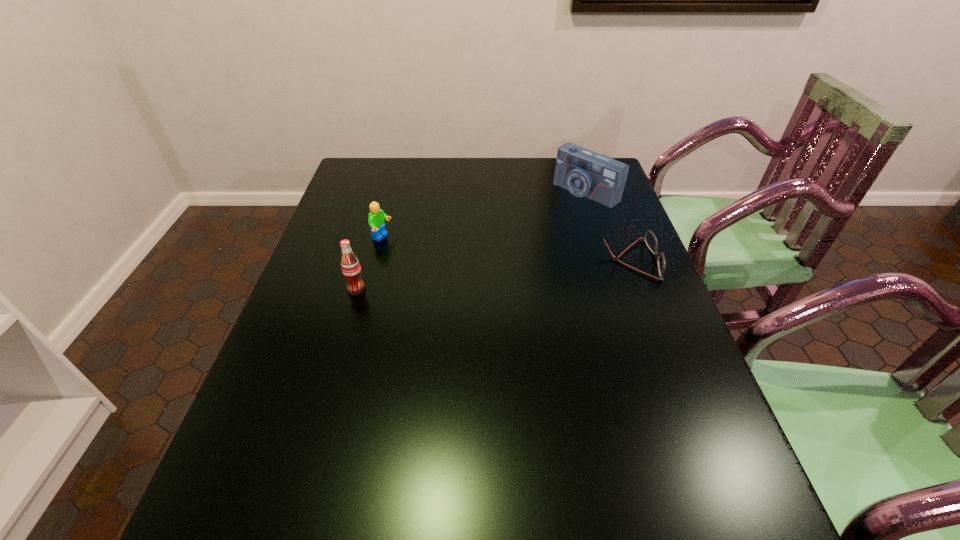
This screenshot has width=960, height=540. Find the location of `vacant space on the desktop that is between the nearest object and the shortest object and is positioned on the lens of the farthest object`. vacant space on the desktop that is between the nearest object and the shortest object and is positioned on the lens of the farthest object is located at coordinates (463, 278).

Identify the location of vacant space on the desktop that is between the soda and the shortest object and is positioned on the face of the Lego. (480, 276).